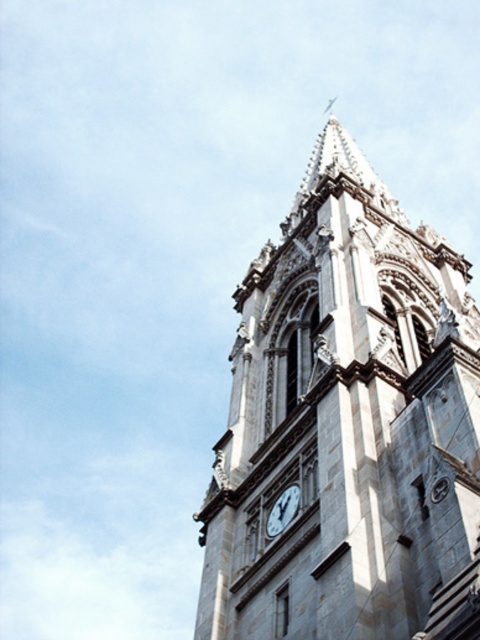
Locate an element on the screen. white stone clock tower at center is located at coordinates (348, 426).

Between white stone clock tower at center and white marble clock at center, which one appears on the right side from the viewer's perspective?

Positioned to the right is white stone clock tower at center.

You are a GUI agent. You are given a task and a screenshot of the screen. Output one action in this format:
    pyautogui.click(x=<x>, y=<y>)
    Task: Click on the white stone clock tower at center
    
    Given the screenshot: What is the action you would take?
    pyautogui.click(x=348, y=426)